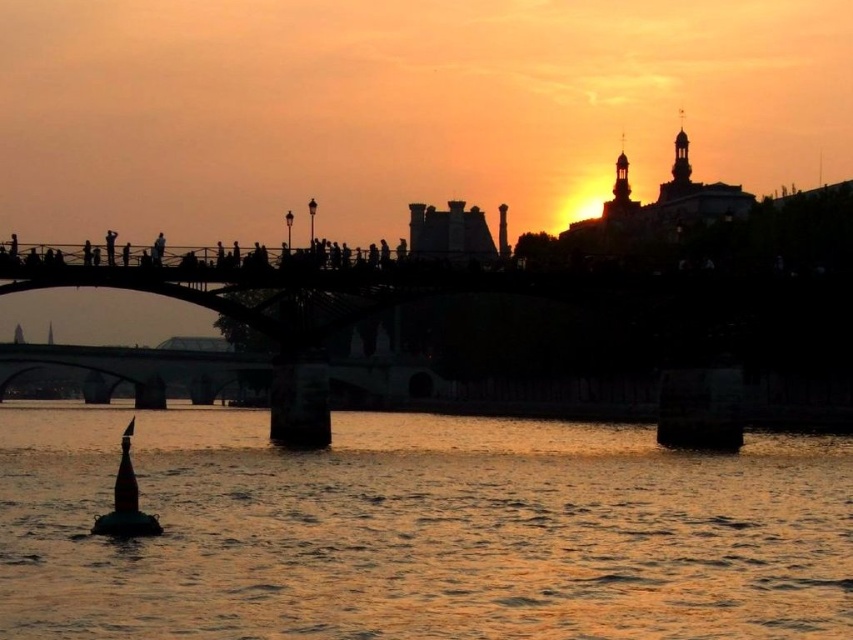
Does golden reflective water at center have a lesser height compared to reddish-brown wooden buoy at lower left?

Yes, golden reflective water at center is shorter than reddish-brown wooden buoy at lower left.

Is point (170, 600) farther from viewer compared to point (114, 493)?

No, (170, 600) is in front of (114, 493).

You are a GUI agent. You are given a task and a screenshot of the screen. Output one action in this format:
    pyautogui.click(x=<x>, y=<y>)
    Task: Click on the golden reflective water at center
    Image resolution: width=853 pixels, height=640 pixels.
    Given the screenshot: What is the action you would take?
    pyautogui.click(x=419, y=531)